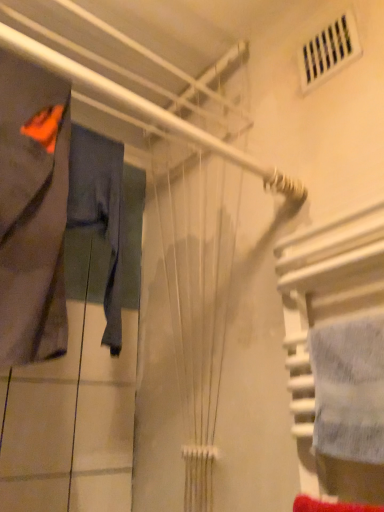
At what (x,y) coordinates should I click in order to perform the action: click on denim pants at left, which is the 2th clothing from front to back. Please return your answer as a coordinate pair (x, y). This screenshot has width=384, height=512. Looking at the image, I should click on (100, 211).

At what (x,y) coordinates should I click in order to perform the action: click on white textured towel at right. Please return your answer as a coordinate pair (x, y). This screenshot has width=384, height=512. Looking at the image, I should click on (349, 390).

Locate an element on the screen. matte gray fabric at left, positioned as the 1th clothing in front-to-back order is located at coordinates (32, 211).

From a real-world perspective, does white textured towel at right sit lower than matte gray fabric at left, positioned as the 1th clothing in front-to-back order?

Correct, in the physical world, white textured towel at right is lower than matte gray fabric at left, positioned as the 1th clothing in front-to-back order.

Does white textured towel at right turn towards matte gray fabric at left, positioned as the 1th clothing in front-to-back order?

No, white textured towel at right is not facing towards matte gray fabric at left, positioned as the 1th clothing in front-to-back order.

Choose the correct answer: Is white textured towel at right inside matte gray fabric at left, the second clothing viewed from the back, or outside it?

white textured towel at right is located beyond the bounds of matte gray fabric at left, the second clothing viewed from the back.

Which of these two, white textured towel at right or denim pants at left, placed as the first clothing when sorted from back to front, is thinner?

white textured towel at right is thinner.

Is white textured towel at right beside denim pants at left, which is the 2th clothing from front to back?

No, white textured towel at right is not beside denim pants at left, which is the 2th clothing from front to back.

From a real-world perspective, is white textured towel at right above or below denim pants at left, placed as the first clothing when sorted from back to front?

Clearly, from a real-world perspective, white textured towel at right is below denim pants at left, placed as the first clothing when sorted from back to front.

Is point (354, 378) farther from camera compared to point (118, 217)?

No.

Which of these two, matte gray fabric at left, the second clothing viewed from the back, or denim pants at left, which is the 2th clothing from front to back, is thinner?

Thinner between the two is denim pants at left, which is the 2th clothing from front to back.

Is denim pants at left, which is the 2th clothing from front to back, at the back of matte gray fabric at left, the second clothing viewed from the back?

No, matte gray fabric at left, the second clothing viewed from the back, is not facing the opposite direction of denim pants at left, which is the 2th clothing from front to back.

Is matte gray fabric at left, positioned as the 1th clothing in front-to-back order, not inside white textured towel at right?

matte gray fabric at left, positioned as the 1th clothing in front-to-back order, is positioned outside white textured towel at right.

Find the location of a particular element. Image resolution: width=384 pixels, height=512 pixels. clothing that is the 2nd one when counting upward from the white textured towel at right (from the image's perspective) is located at coordinates (32, 211).

Consider the image. Is matte gray fabric at left, the second clothing viewed from the back, oriented away from white textured towel at right?

No, matte gray fabric at left, the second clothing viewed from the back, is not facing away from white textured towel at right.

Which of these two, denim pants at left, placed as the first clothing when sorted from back to front, or white textured towel at right, is wider?

denim pants at left, placed as the first clothing when sorted from back to front.

Is denim pants at left, placed as the first clothing when sorted from back to front, bigger than white textured towel at right?

Correct, denim pants at left, placed as the first clothing when sorted from back to front, is larger in size than white textured towel at right.

Can you confirm if denim pants at left, placed as the first clothing when sorted from back to front, is taller than white textured towel at right?

Correct, denim pants at left, placed as the first clothing when sorted from back to front, is much taller as white textured towel at right.

In terms of height, does denim pants at left, which is the 2th clothing from front to back, look taller or shorter compared to matte gray fabric at left, the second clothing viewed from the back?

denim pants at left, which is the 2th clothing from front to back, is shorter than matte gray fabric at left, the second clothing viewed from the back.

Do you think denim pants at left, placed as the first clothing when sorted from back to front, is within matte gray fabric at left, positioned as the 1th clothing in front-to-back order, or outside of it?

denim pants at left, placed as the first clothing when sorted from back to front, cannot be found inside matte gray fabric at left, positioned as the 1th clothing in front-to-back order.

Is denim pants at left, which is the 2th clothing from front to back, next to matte gray fabric at left, positioned as the 1th clothing in front-to-back order?

No, denim pants at left, which is the 2th clothing from front to back, is not touching matte gray fabric at left, positioned as the 1th clothing in front-to-back order.

Is denim pants at left, placed as the first clothing when sorted from back to front, further to camera compared to matte gray fabric at left, the second clothing viewed from the back?

Yes.

At what (x,y) coordinates should I click in order to perform the action: click on towel in front of the matte gray fabric at left, the second clothing viewed from the back. Please return your answer as a coordinate pair (x, y). The height and width of the screenshot is (512, 384). Looking at the image, I should click on (349, 390).

You are a GUI agent. You are given a task and a screenshot of the screen. Output one action in this format:
    pyautogui.click(x=<x>, y=<y>)
    Task: Click on the clothing that is the 2nd one above the white textured towel at right (from a real-world perspective)
    The width and height of the screenshot is (384, 512).
    Given the screenshot: What is the action you would take?
    pyautogui.click(x=100, y=211)

Which object lies nearer to the anchor point denim pants at left, which is the 2th clothing from front to back, matte gray fabric at left, positioned as the 1th clothing in front-to-back order, or white textured towel at right?

matte gray fabric at left, positioned as the 1th clothing in front-to-back order, is positioned closer to the anchor denim pants at left, which is the 2th clothing from front to back.

From the image, which object appears to be nearer to matte gray fabric at left, positioned as the 1th clothing in front-to-back order, white textured towel at right or denim pants at left, placed as the first clothing when sorted from back to front?

denim pants at left, placed as the first clothing when sorted from back to front.

Based on their spatial positions, is denim pants at left, which is the 2th clothing from front to back, or matte gray fabric at left, positioned as the 1th clothing in front-to-back order, further from white textured towel at right?

The object further to white textured towel at right is denim pants at left, which is the 2th clothing from front to back.

Looking at the image, which one is located further to matte gray fabric at left, positioned as the 1th clothing in front-to-back order, denim pants at left, placed as the first clothing when sorted from back to front, or white textured towel at right?

white textured towel at right is positioned further to the anchor matte gray fabric at left, positioned as the 1th clothing in front-to-back order.

From the picture: Which object lies nearer to the anchor point white textured towel at right, matte gray fabric at left, the second clothing viewed from the back, or denim pants at left, placed as the first clothing when sorted from back to front?

matte gray fabric at left, the second clothing viewed from the back, lies closer to white textured towel at right than the other object.

Estimate the real-world distances between objects in this image. Which object is closer to denim pants at left, placed as the first clothing when sorted from back to front, white textured towel at right or matte gray fabric at left, positioned as the 1th clothing in front-to-back order?

The object closer to denim pants at left, placed as the first clothing when sorted from back to front, is matte gray fabric at left, positioned as the 1th clothing in front-to-back order.

Locate an element on the screen. clothing located between matte gray fabric at left, the second clothing viewed from the back, and white textured towel at right in the left-right direction is located at coordinates (100, 211).